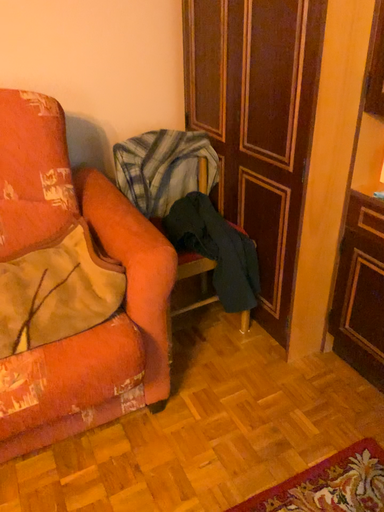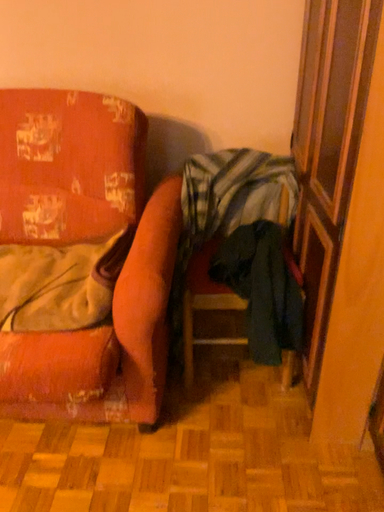
Question: Which way did the camera rotate in the video?

Choices:
 (A) rotated right
 (B) rotated left

Answer: (B)